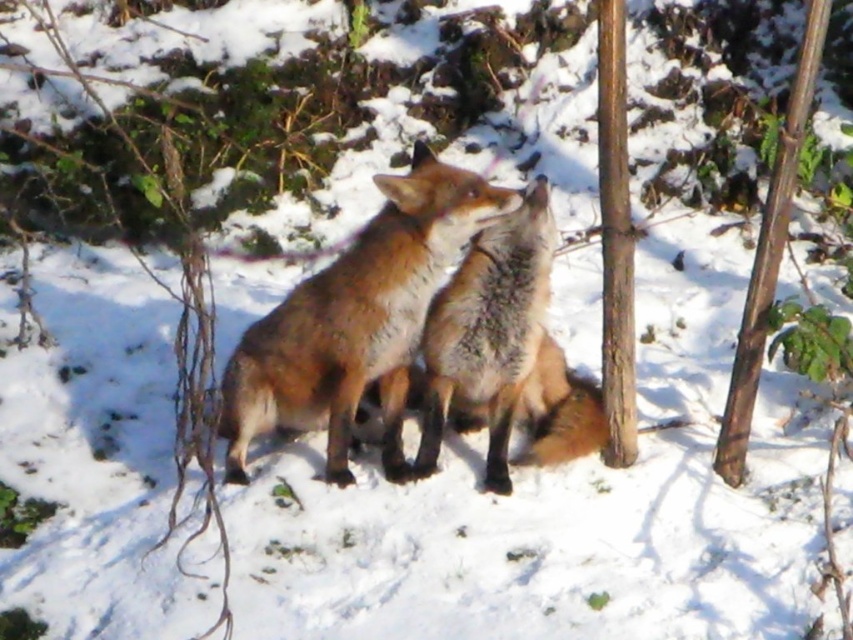
Question: Does brown fur fox at center have a lesser width compared to brown wood pole at center?

Choices:
 (A) yes
 (B) no

Answer: (B)

Question: Considering the real-world distances, which object is farthest from the smooth brown pole at right?

Choices:
 (A) brown fur fox at center
 (B) brown wood pole at center

Answer: (A)

Question: From the image, what is the correct spatial relationship of brown fur fox at center in relation to smooth brown pole at right?

Choices:
 (A) left
 (B) right

Answer: (A)

Question: Estimate the real-world distances between objects in this image. Which object is farther from the brown fur fox at center?

Choices:
 (A) smooth brown pole at right
 (B) brown wood pole at center

Answer: (B)

Question: In this image, where is brown fur fox at center located relative to brown wood pole at center?

Choices:
 (A) above
 (B) below

Answer: (B)

Question: Among these points, which one is farthest from the camera?

Choices:
 (A) (619, 300)
 (B) (775, 291)

Answer: (A)